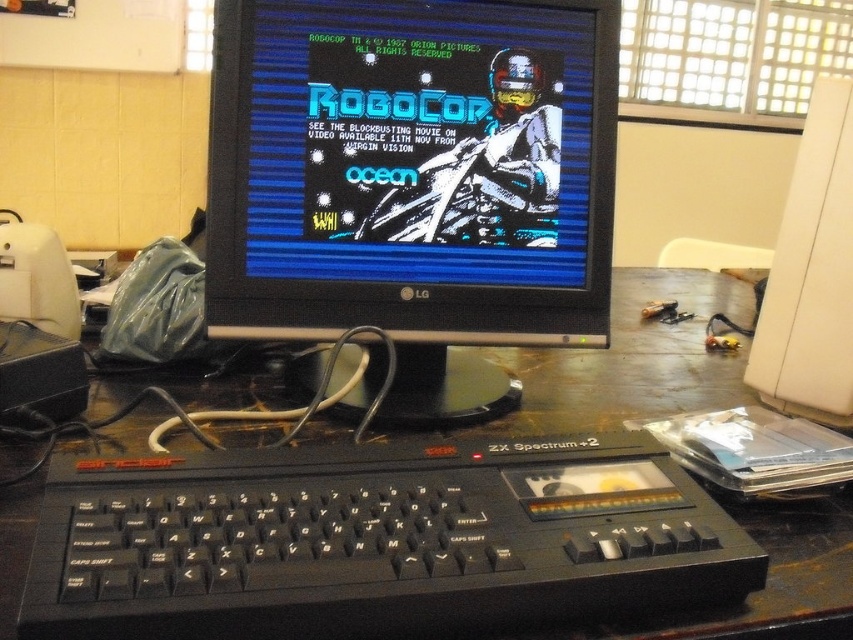
Question: Is black plastic computer desk at center positioned before white plastic monitor at right?

Choices:
 (A) yes
 (B) no

Answer: (A)

Question: Is black plastic keyboard at lower center to the right of black plastic computer desk at center from the viewer's perspective?

Choices:
 (A) no
 (B) yes

Answer: (A)

Question: Among these objects, which one is farthest from the camera?

Choices:
 (A) black plastic computer desk at center
 (B) black plastic keyboard at lower center

Answer: (A)

Question: Which is farther from the black plastic keyboard at lower center?

Choices:
 (A) white plastic monitor at right
 (B) black plastic computer desk at center

Answer: (A)

Question: Which object is positioned closest to the white plastic monitor at right?

Choices:
 (A) black plastic keyboard at lower center
 (B) black plastic computer desk at center

Answer: (B)

Question: Can you confirm if black plastic keyboard at lower center is wider than black plastic computer desk at center?

Choices:
 (A) yes
 (B) no

Answer: (B)